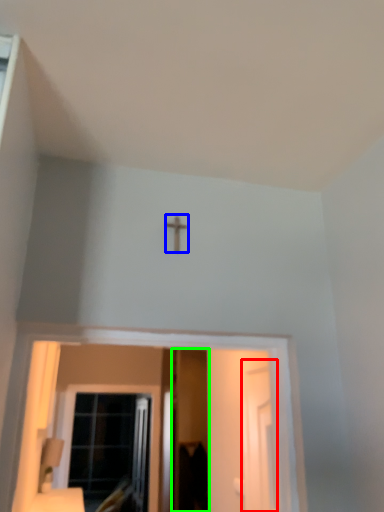
Question: Which object is the closest to the screen door (highlighted by a red box)? Choose among these: crucifix (highlighted by a blue box) or screen door (highlighted by a green box).

Choices:
 (A) crucifix
 (B) screen door

Answer: (A)